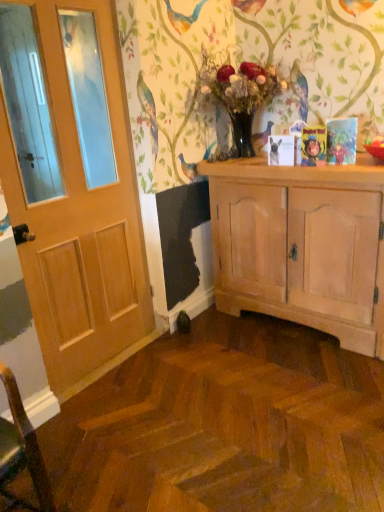
Identify the location of blank space to the left of cartoon character book at upper right. Image resolution: width=384 pixels, height=512 pixels. (288, 169).